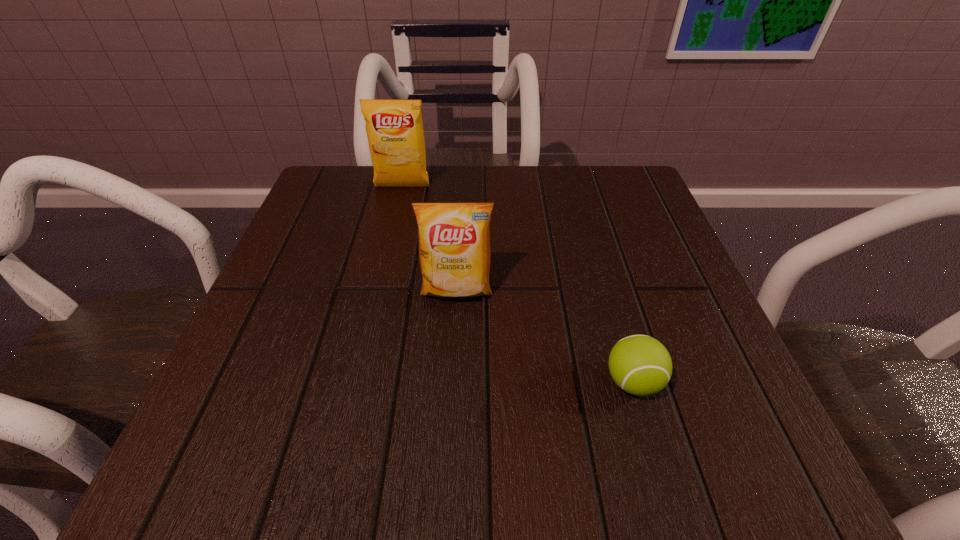
Find the location of `the leftmost object`. the leftmost object is located at coordinates (394, 128).

The width and height of the screenshot is (960, 540). I want to click on the farther crisp (potato chip), so click(394, 128).

Find the location of a particular element. the second shortest object is located at coordinates (454, 238).

The image size is (960, 540). I want to click on the nearer crisp (potato chip), so click(454, 238).

Where is `tennis ball`? The height and width of the screenshot is (540, 960). tennis ball is located at coordinates (640, 365).

Where is `the rightmost object`? The height and width of the screenshot is (540, 960). the rightmost object is located at coordinates (640, 365).

Locate an element on the screen. vacant space located 0.340m on the front of the left crisp (potato chip) with the logo is located at coordinates (375, 305).

Identify the location of free space located 0.220m on the front-facing side of the right crisp (potato chip). (449, 431).

Where is `vacant space located on the back of the shortest object`? Image resolution: width=960 pixels, height=540 pixels. vacant space located on the back of the shortest object is located at coordinates (588, 227).

Find the location of a particular element. object located in the far edge section of the desktop is located at coordinates (394, 128).